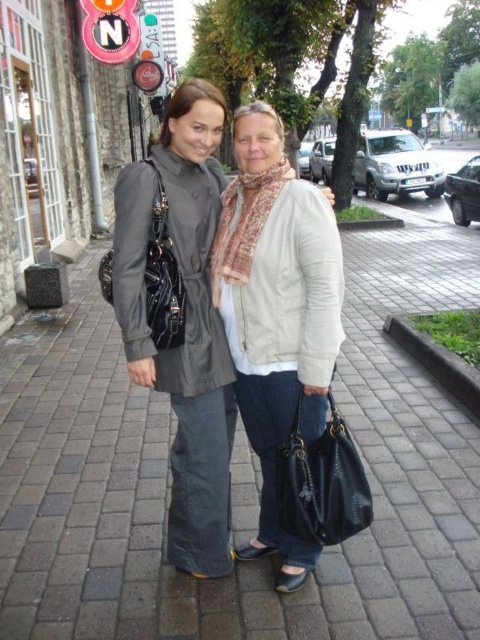
Question: Can you confirm if matte gray pavement at center is thinner than black leather handbag at center?

Choices:
 (A) no
 (B) yes

Answer: (A)

Question: Which of these objects is positioned closest to the matte black bag at left?

Choices:
 (A) matte gray pavement at center
 (B) matte beige jacket at center
 (C) brushed metal sign at upper center

Answer: (B)

Question: Considering the relative positions of matte gray pavement at center and brushed metal sign at upper center in the image provided, where is matte gray pavement at center located with respect to brushed metal sign at upper center?

Choices:
 (A) below
 (B) above

Answer: (A)

Question: Which object is closer to the camera taking this photo?

Choices:
 (A) matte gray coat at center
 (B) black leather handbag at center
 (C) matte black bag at left

Answer: (B)

Question: Estimate the real-world distances between objects in this image. Which object is closer to the brushed metal sign at upper center?

Choices:
 (A) matte black bag at left
 (B) black leather handbag at center
 (C) matte gray pavement at center

Answer: (C)

Question: Is black leather handbag at center bigger than matte black bag at left?

Choices:
 (A) yes
 (B) no

Answer: (B)